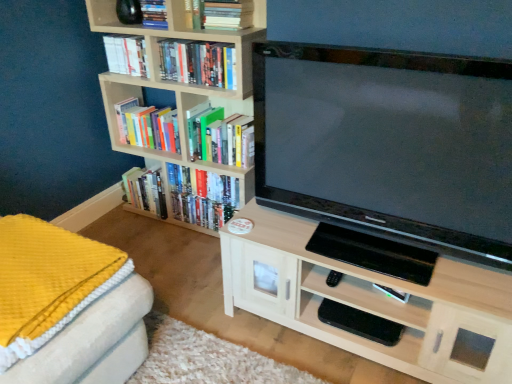
Locate an element on the screen. vacant area on top of matte black tv at center (from a real-world perspective) is located at coordinates (390, 52).